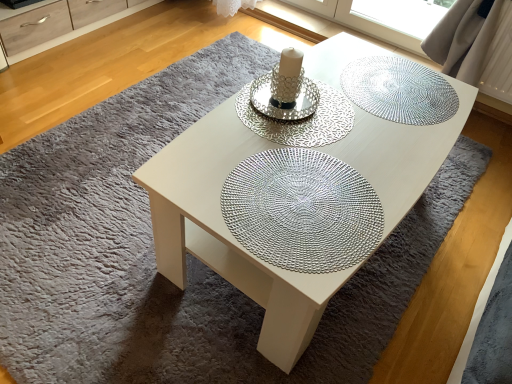
This screenshot has width=512, height=384. I want to click on vacant space situated above white glossy coffee table at center (from a real-world perspective), so click(x=335, y=131).